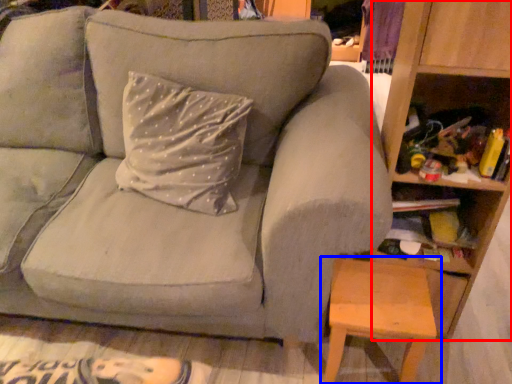
Question: Which of the following is the farthest to the observer, bookshelf (highlighted by a red box) or table (highlighted by a blue box)?

Choices:
 (A) bookshelf
 (B) table

Answer: (B)